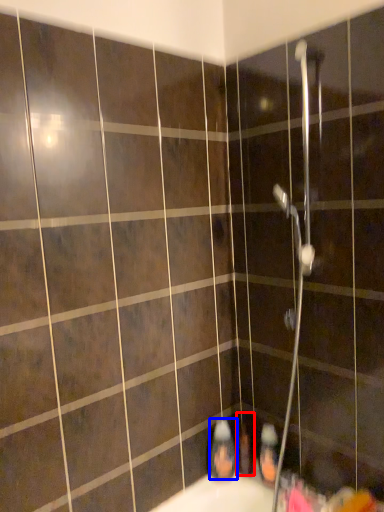
Question: Among these objects, which one is nearest to the camera, toiletry (highlighted by a red box) or toiletry (highlighted by a blue box)?

Choices:
 (A) toiletry
 (B) toiletry

Answer: (B)